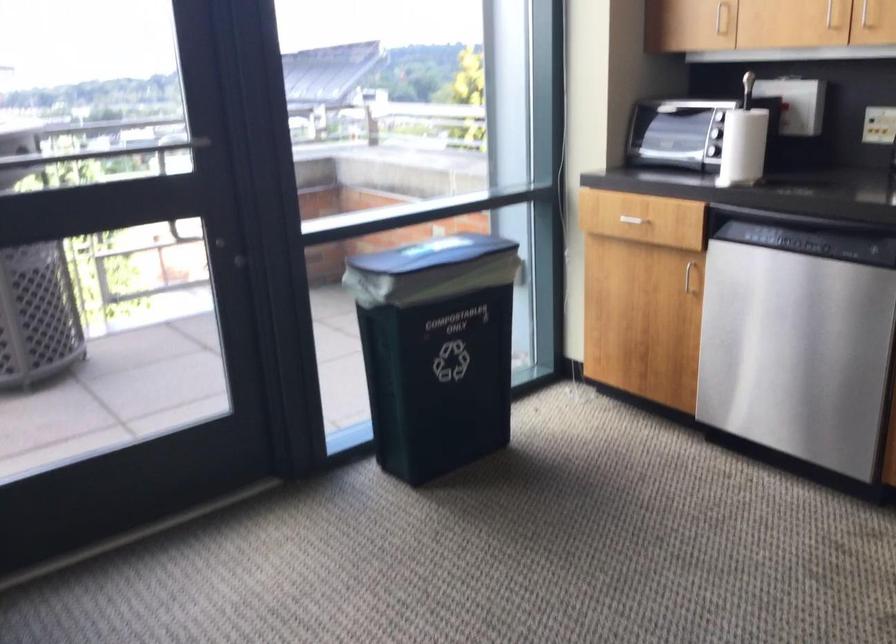
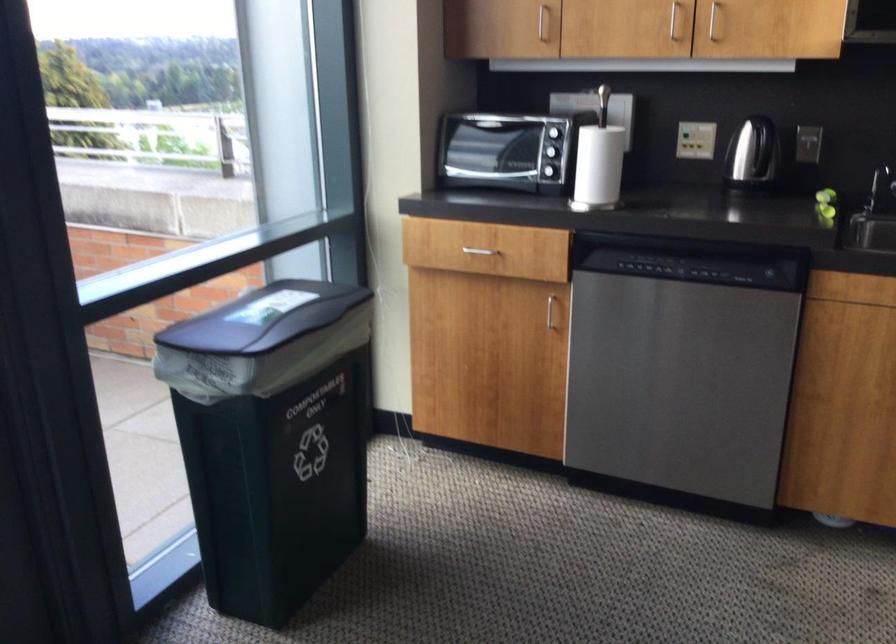
Find the pixel in the second image that matches (x=634, y=209) in the first image.

(474, 241)